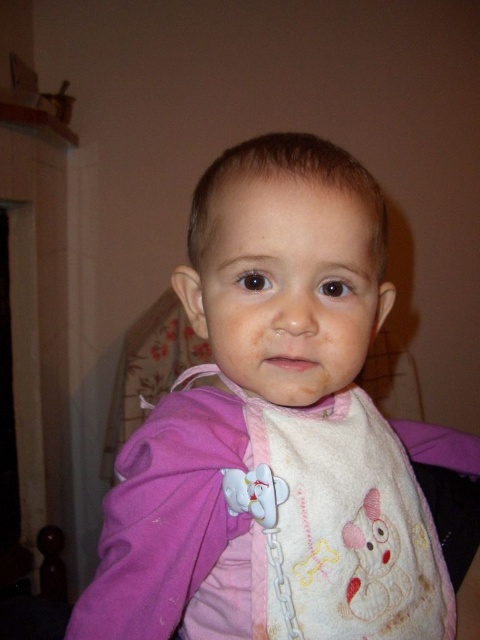
You are a photographer trying to capture a closeup of the child in the image. You notice two bibs, the pink fabric bib at center and the white fabric bib at center. Which bib is positioned in front of the other?

The pink fabric bib at center is closer to the viewer than the white fabric bib at center, so the pink one is in front.

You are taking a photo of a child and want to focus on the point that is closer to the camera. Which point should you choose between point [367,548] and point [271,566]?

Point [271,566] is closer to the camera than point [367,548], so you should choose point [271,566] to focus on.